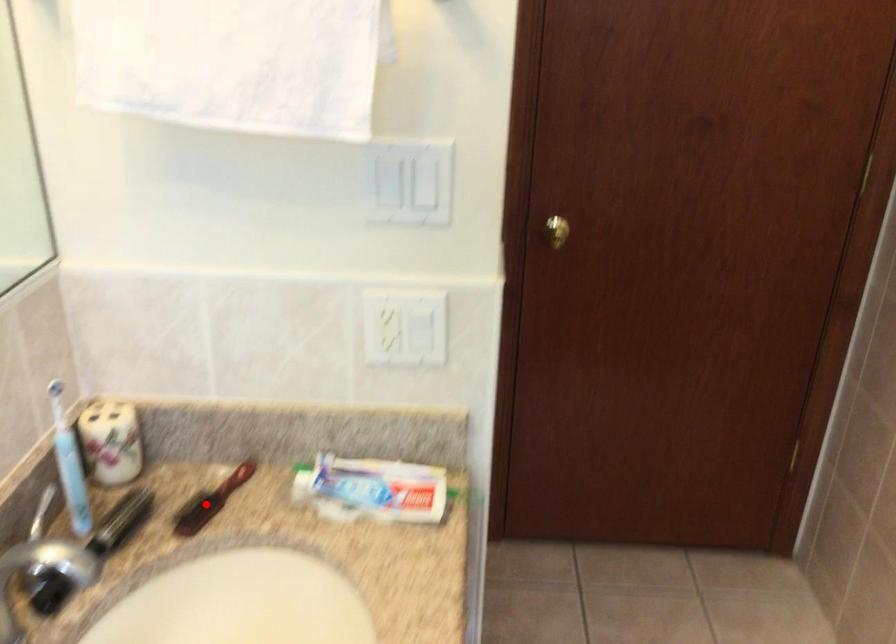
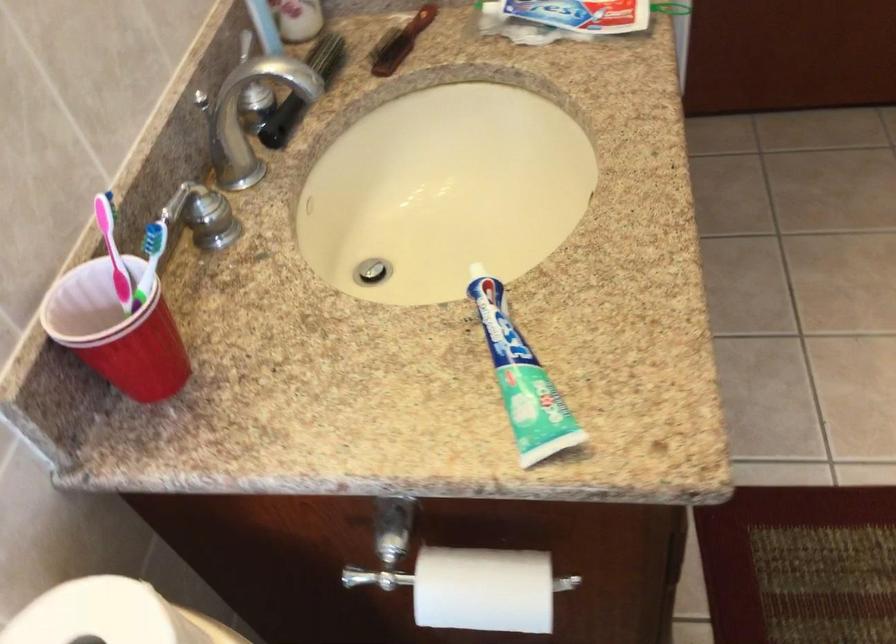
The point at the highlighted location is marked in the first image. Where is the corresponding point in the second image?

(400, 42)